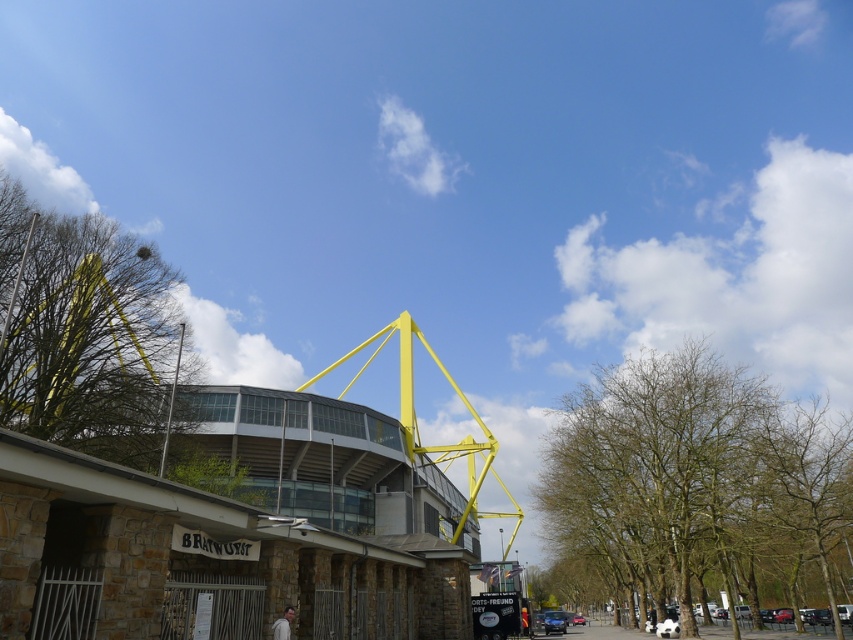
Who is lower down, yellow metallic structure at center or bare branches at center?

Positioned lower is bare branches at center.

Does yellow metallic structure at center appear on the right side of bare branches at center?

Incorrect, yellow metallic structure at center is not on the right side of bare branches at center.

This screenshot has height=640, width=853. What do you see at coordinates (229, 538) in the screenshot? I see `yellow metallic structure at center` at bounding box center [229, 538].

I want to click on yellow metallic structure at center, so click(229, 538).

Which of these two, bare branches at center or green leafy tree at upper left, stands shorter?

green leafy tree at upper left

Which of these two, bare branches at center or green leafy tree at upper left, stands taller?

bare branches at center

Image resolution: width=853 pixels, height=640 pixels. What are the coordinates of `bare branches at center` in the screenshot? It's located at (695, 486).

The height and width of the screenshot is (640, 853). I want to click on bare branches at center, so click(x=695, y=486).

Can you confirm if yellow metallic structure at center is positioned below green leafy tree at upper left?

Indeed, yellow metallic structure at center is positioned under green leafy tree at upper left.

Is point (138, 628) closer to viewer compared to point (67, 337)?

Yes.

This screenshot has width=853, height=640. I want to click on yellow metallic structure at center, so click(x=229, y=538).